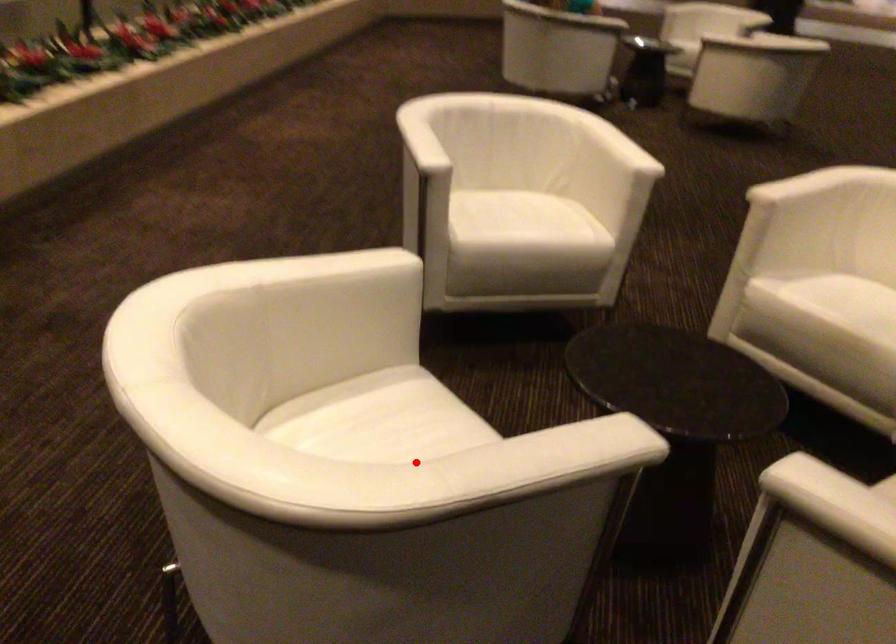
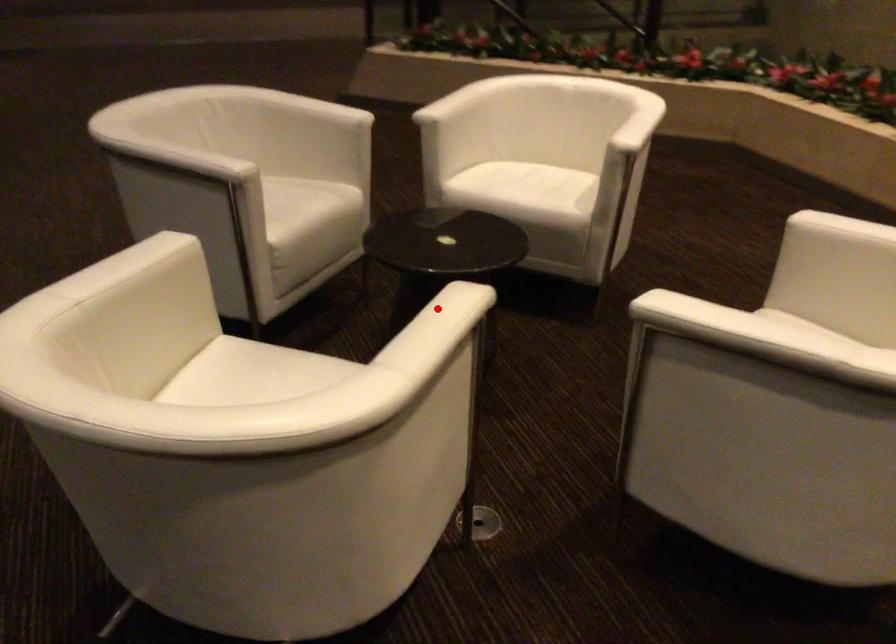
I am providing you with two images of the same scene from different viewpoints. A red point is marked on the first image and another point is marked on the second image. Do the highlighted points in image1 and image2 indicate the same real-world spot?

No